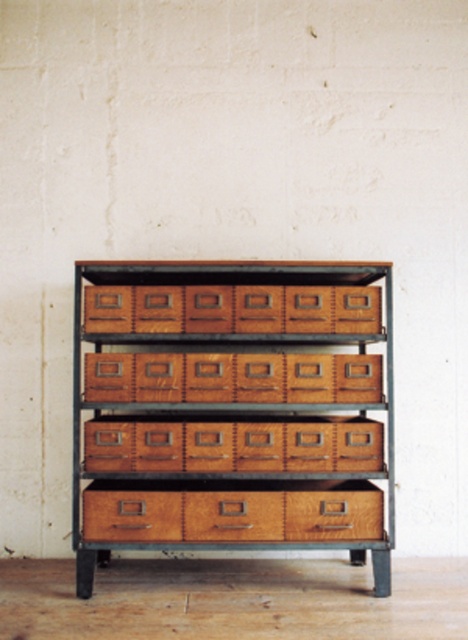
Question: Which of the following is the closest to the observer?

Choices:
 (A) brown wood drawer at center
 (B) natural wood drawer at lower center

Answer: (B)

Question: Which point is farther from the camera taking this photo?

Choices:
 (A) (314, 538)
 (B) (125, 508)
 (C) (241, 284)
 (D) (156, 536)

Answer: (C)

Question: Which point is farther from the camera taking this photo?

Choices:
 (A) (336, 488)
 (B) (219, 401)

Answer: (A)

Question: Can you confirm if wooden crate at center is thinner than brown wood drawer at center?

Choices:
 (A) yes
 (B) no

Answer: (B)

Question: Is wooden drawer at lower center thinner than wooden grain drawer at center?

Choices:
 (A) no
 (B) yes

Answer: (A)

Question: From the image, what is the correct spatial relationship of natural wood drawer at lower center in relation to wooden grain drawer at center?

Choices:
 (A) left
 (B) right

Answer: (A)